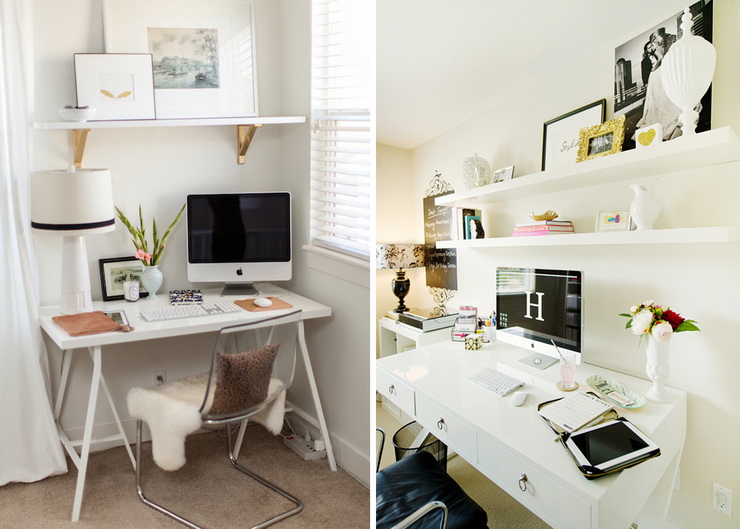
You are a GUI agent. You are given a task and a screenshot of the screen. Output one action in this format:
    pyautogui.click(x=<x>, y=<y>)
    Task: Click on the computer monitors
    The height and width of the screenshot is (529, 740).
    Given the screenshot: What is the action you would take?
    pyautogui.click(x=534, y=305), pyautogui.click(x=235, y=242)